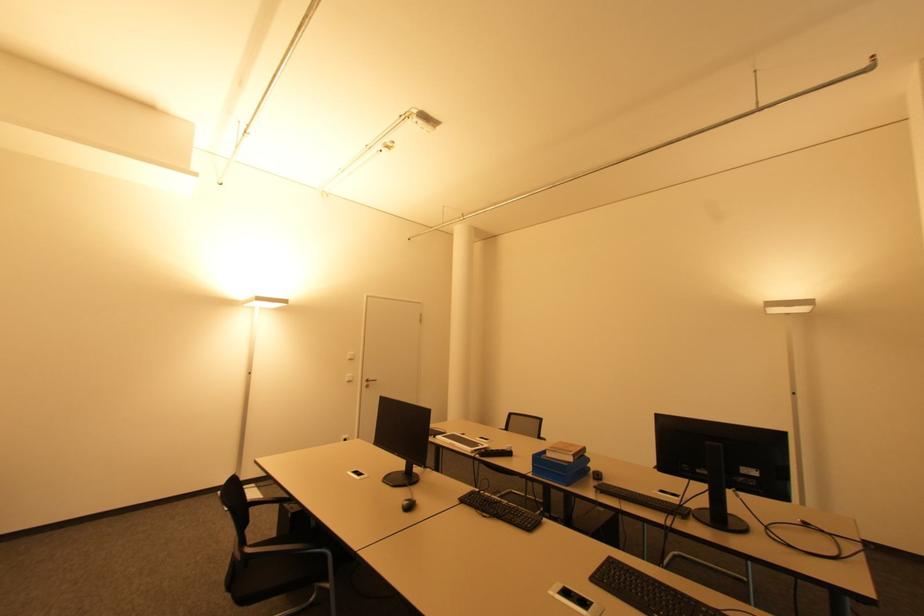
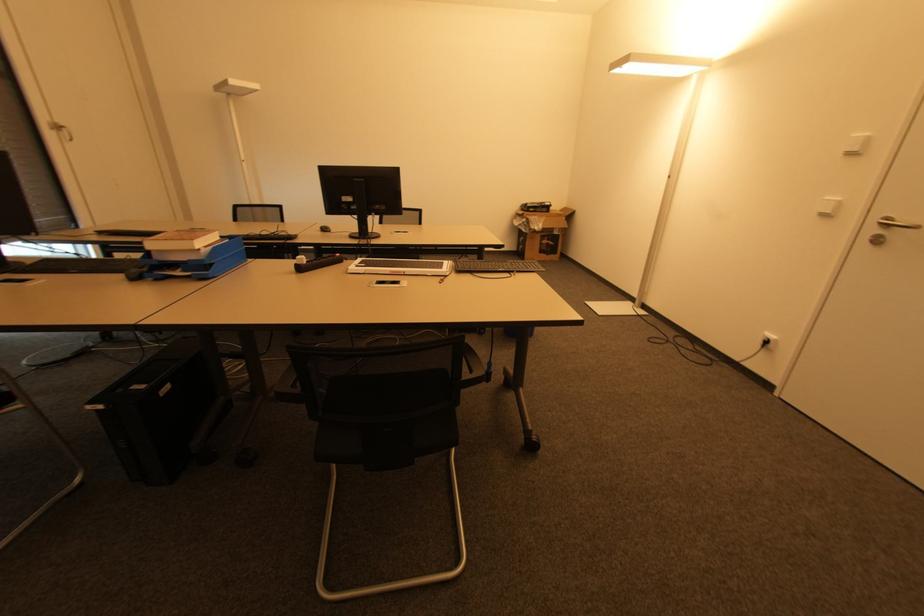
Find the pixel in the second image that matches point 410,508 in the first image.

(325, 230)